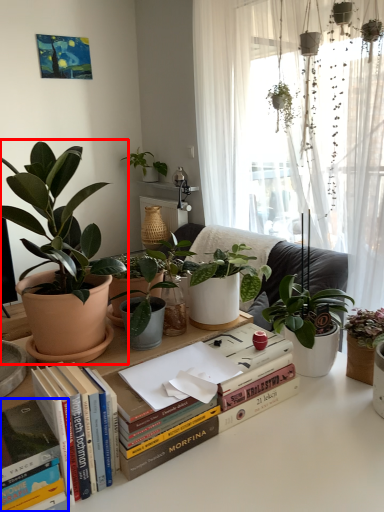
Question: Which of the following is the farthest to the observer, houseplant (highlighted by a red box) or paperback book (highlighted by a blue box)?

Choices:
 (A) houseplant
 (B) paperback book

Answer: (A)